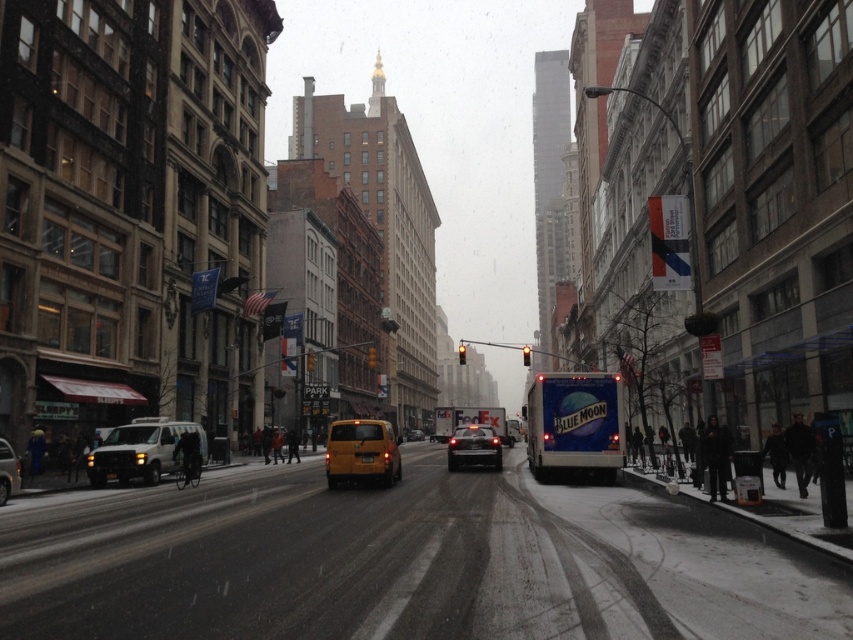
You are a pedestrian standing on the snowy street and want to hail a ride. You see a yellow matte taxi at center and a yellow matte van at center. Which one is closer to you?

The yellow matte taxi at center is closer to the viewer than the yellow matte van at center, so you should hail the yellow matte taxi at center first since it is nearer.

You are a delivery person standing at the corner of the street. You need to find the yellow matte taxi cab at center to load your packages. According to the map, the taxi is located at coordinates 0.738, 0.011. Which direction should you walk to reach it?

The yellow matte taxi cab at center is located at coordinates (9, 472), so you should walk towards the center of the street to reach it.

You are a pedestrian standing on the snowy sidewalk and want to cross the street to reach the red awning labeled Sleepy. You see a yellow matte taxi at center and a yellow matte van at center. Which vehicle should you avoid stepping in front of if you want to cross safely?

The yellow matte taxi at center is positioned on the left side of the yellow matte van at center. Since vehicles in this context typically drive on the right side of the road, the yellow matte van at center is likely moving forward, so you should avoid stepping in front of the yellow matte van at center to cross safely.